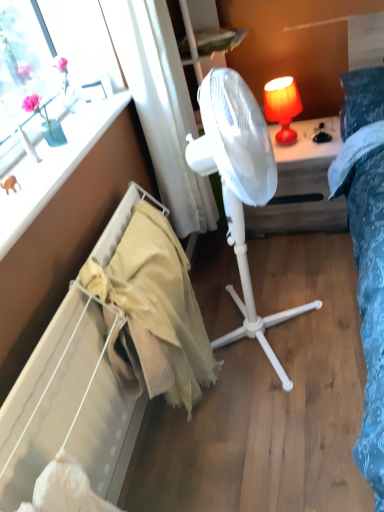
Locate an element on the screen. Image resolution: width=384 pixels, height=512 pixels. vacant space situated above matte white window sill at upper left (from a real-world perspective) is located at coordinates (59, 144).